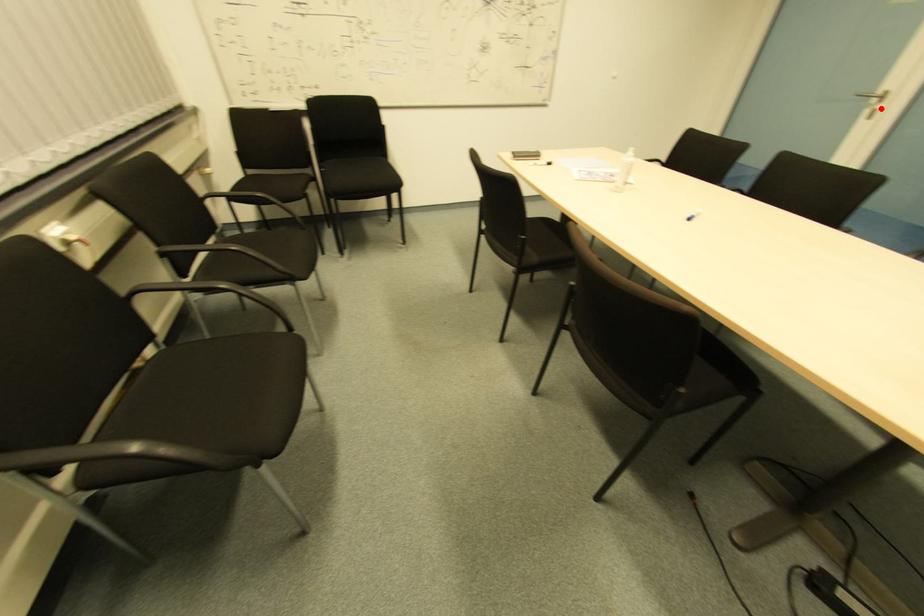
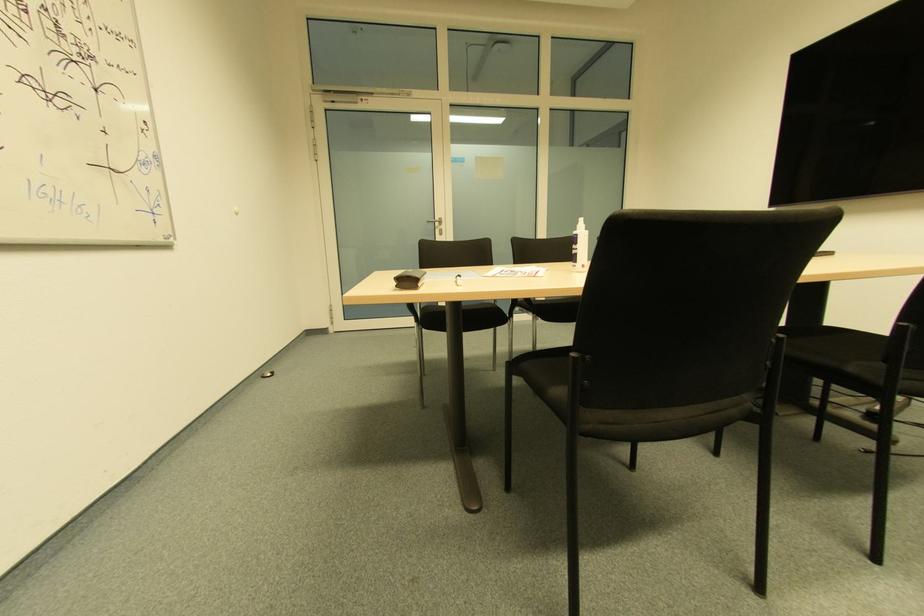
Question: I am providing you with two images of the same scene from different viewpoints. Image1 has a red point marked. In image2, the corresponding 3D location appears at what relative position? Reply with the corresponding letter.

Choices:
 (A) Closer
 (B) Farther

Answer: (A)